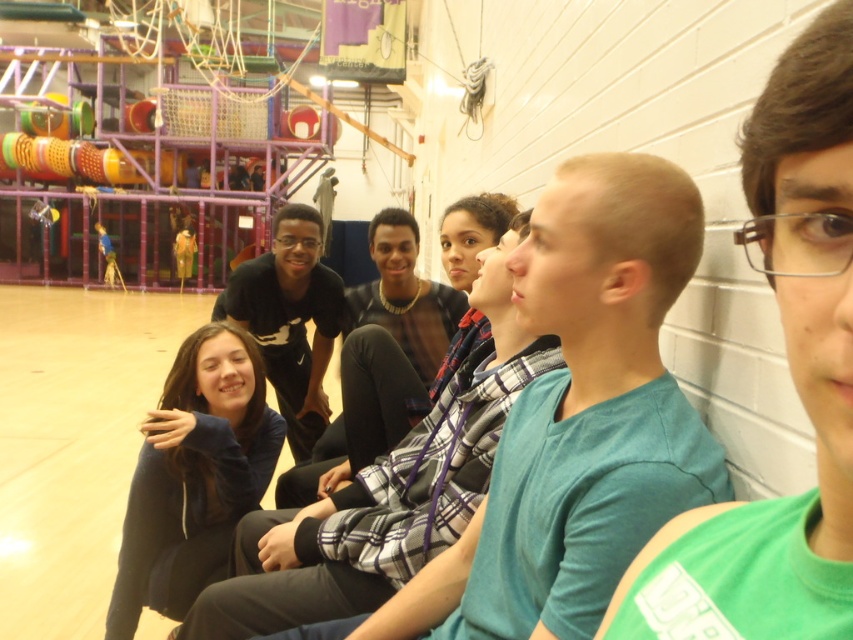
You are standing in the gymnasium and see the teal cotton shirt at center and the dark blue hoodie at center. Which one is closer to you?

The teal cotton shirt at center is closer to you because it is in front of the dark blue hoodie at center.

You are standing at the point with coordinates (250, 417) and want to move towards the climbing structure. Is the point at (523, 307) blocking your path?

Point (523, 307) is in front of point (250, 417), so yes, it is blocking your path.